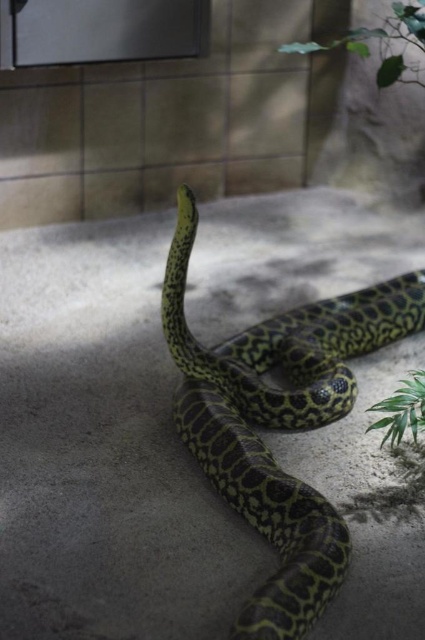
Consider the image. You are a wildlife photographer trying to capture a closeup of the green leafy plant at upper right. However, the green textured snake at center is blocking your view. Can you estimate if the snake is wider than the plant?

The green textured snake at center might be wider than green leafy plant at upper right, so there is a possibility that the snake is blocking the view of the green leafy plant at upper right.

Looking at this image, you are a photographer setting up a shot of the green textured snake at center and the green leafy plant at upper right. If you want to position your camera so that the snake is directly to the left of the plant in the frame, is the current arrangement already correct?

Yes, the current arrangement is correct because the green textured snake at center is already positioned to the left of the green leafy plant at upper right.